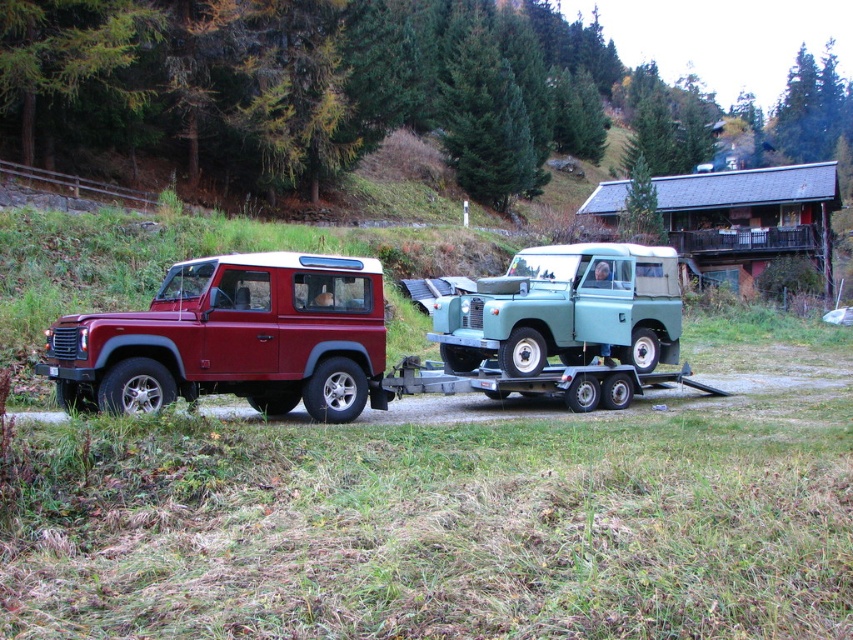
You are standing at the point marked by the coordinates (376, 333) in the image. Looking around, you see the red Land Rover Defender parked on a gravel surface and the light blue vintage Land Rover being towed on a flatbed trailer. Which vehicle are you closest to?

The point (376, 333) corresponds to the matte red tow truck at left, so you are closest to the red Land Rover Defender parked on a gravel surface.

You are driving a car and need to pass through a narrow path between the matte red tow truck at left and the light green matte jeep at center. Which side should you drive on to avoid hitting either vehicle?

The matte red tow truck at left is to the left of the light green matte jeep at center. To avoid hitting either vehicle, you should drive on the right side of the path, staying clear of the matte red tow truck at left which is positioned further left.

Looking at this image, you are standing in the rural outdoor setting depicted in the image. You notice two points marked on the scene. The first point is at coordinates point (647, 362), and the second is at point (469, 300). Which point is closer to your current position?

Point (647, 362) is further to the viewer than point (469, 300), so the second point at point (469, 300) is closer to your current position.